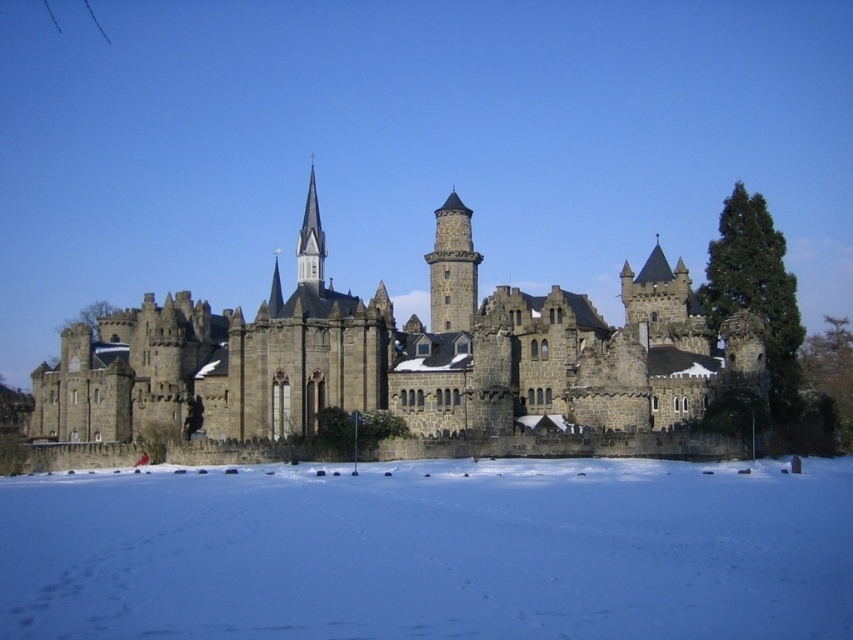
Can you confirm if dark stone castle at center is taller than smooth gray steeple at center?

Indeed, dark stone castle at center has a greater height compared to smooth gray steeple at center.

Can you confirm if dark stone castle at center is thinner than smooth gray steeple at center?

No, dark stone castle at center is not thinner than smooth gray steeple at center.

Between point (698, 312) and point (318, 289), which one is positioned in front?

Point (318, 289)

At what (x,y) coordinates should I click in order to perform the action: click on dark stone castle at center. Please return your answer as a coordinate pair (x, y). Looking at the image, I should click on (395, 365).

Is point (77, 550) positioned before point (659, 397)?

Yes, it is.

Which is behind, point (480, 532) or point (293, 384)?

Positioned behind is point (293, 384).

This screenshot has height=640, width=853. Find the location of `white powdery snow at lower center`. white powdery snow at lower center is located at coordinates (432, 552).

Can you confirm if dark gray stone tower at center is taller than smooth gray steeple at center?

No, dark gray stone tower at center is not taller than smooth gray steeple at center.

Which is more to the right, dark gray stone tower at center or smooth gray steeple at center?

dark gray stone tower at center is more to the right.

The height and width of the screenshot is (640, 853). In order to click on dark gray stone tower at center in this screenshot , I will do `click(451, 268)`.